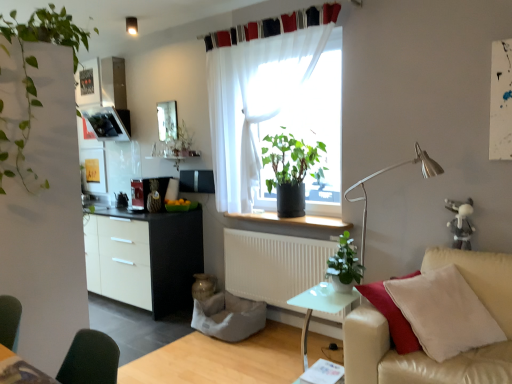
You are a GUI agent. You are given a task and a screenshot of the screen. Output one action in this format:
    pyautogui.click(x=<x>, y=<y>)
    Task: Click on the vacant space underneath white sheer curtain at upper center, acting as the 1th curtain starting from the top (from a real-world perspective)
    Image resolution: width=512 pixels, height=384 pixels.
    Given the screenshot: What is the action you would take?
    pyautogui.click(x=259, y=26)